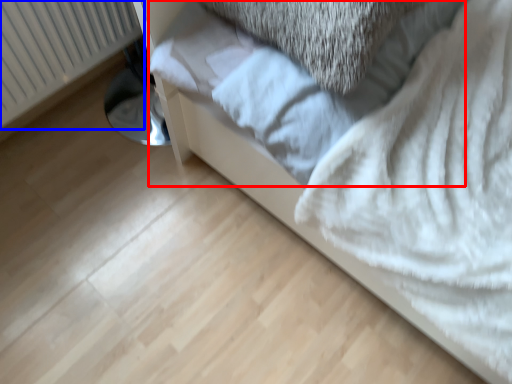
Question: Among these objects, which one is nearest to the camera, sheet (highlighted by a red box) or radiator (highlighted by a blue box)?

Choices:
 (A) sheet
 (B) radiator

Answer: (A)